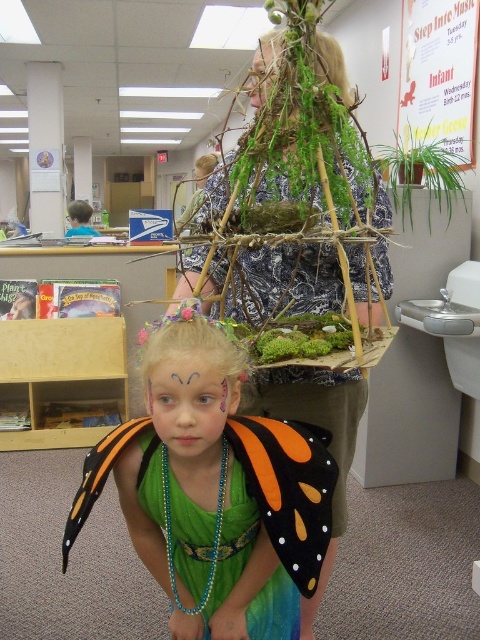
You are standing at point (394,180) and want to walk to point (204,582). Is there a clear path between these two points?

Yes, since point (204,582) is in front of point (394,180), there is a clear path between them.

You are an observer in the scene. You notice the green sequined dress at center and the smooth skin face at center. Which object is positioned to the right of the other?

The green sequined dress at center is to the right of the smooth skin face at center.